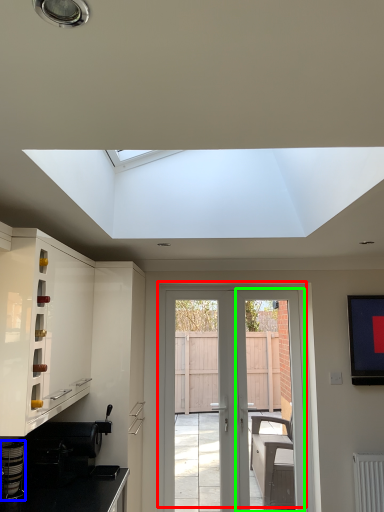
Question: Which object is positioned closest to door (highlighted by a red box)? Select from appliance (highlighted by a blue box) and screen door (highlighted by a green box).

Choices:
 (A) appliance
 (B) screen door

Answer: (B)